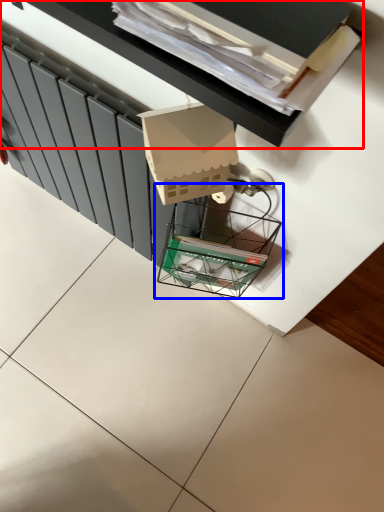
Question: Among these objects, which one is nearest to the camera, vanity (highlighted by a red box) or glass box (highlighted by a blue box)?

Choices:
 (A) vanity
 (B) glass box

Answer: (A)